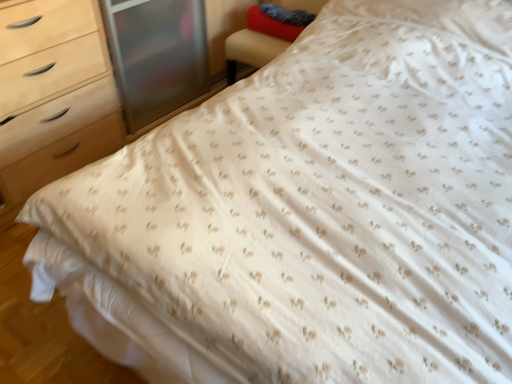
Question: From a real-world perspective, is velvet blue pillow at upper right, positioned as the 2th pillow in back-to-front order, on top of velvet-like red pillow at upper right, arranged as the first pillow when viewed from the back?

Choices:
 (A) yes
 (B) no

Answer: (A)

Question: Considering the relative sizes of velvet blue pillow at upper right, positioned as the 2th pillow in back-to-front order, and velvet-like red pillow at upper right, arranged as the first pillow when viewed from the back, in the image provided, is velvet blue pillow at upper right, positioned as the 2th pillow in back-to-front order, smaller than velvet-like red pillow at upper right, arranged as the first pillow when viewed from the back,?

Choices:
 (A) no
 (B) yes

Answer: (B)

Question: Does velvet blue pillow at upper right, which is the first pillow in front-to-back order, appear on the left side of velvet-like red pillow at upper right, arranged as the first pillow when viewed from the back?

Choices:
 (A) no
 (B) yes

Answer: (B)

Question: Is velvet blue pillow at upper right, positioned as the 2th pillow in back-to-front order, completely or partially outside of velvet-like red pillow at upper right, which appears as the second pillow when viewed from the front?

Choices:
 (A) yes
 (B) no

Answer: (A)

Question: Can you confirm if velvet blue pillow at upper right, positioned as the 2th pillow in back-to-front order, is bigger than velvet-like red pillow at upper right, arranged as the first pillow when viewed from the back?

Choices:
 (A) no
 (B) yes

Answer: (A)

Question: Visually, is velvet-like red pillow at upper right, which appears as the second pillow when viewed from the front, positioned to the left or to the right of velvet blue pillow at upper right, positioned as the 2th pillow in back-to-front order?

Choices:
 (A) right
 (B) left

Answer: (A)

Question: Is velvet-like red pillow at upper right, arranged as the first pillow when viewed from the back, situated inside velvet blue pillow at upper right, which is the first pillow in front-to-back order, or outside?

Choices:
 (A) outside
 (B) inside

Answer: (A)

Question: Is velvet-like red pillow at upper right, arranged as the first pillow when viewed from the back, wider or thinner than velvet blue pillow at upper right, positioned as the 2th pillow in back-to-front order?

Choices:
 (A) wide
 (B) thin

Answer: (A)

Question: Is velvet-like red pillow at upper right, arranged as the first pillow when viewed from the back, in front of or behind velvet blue pillow at upper right, which is the first pillow in front-to-back order, in the image?

Choices:
 (A) front
 (B) behind

Answer: (B)

Question: Considering the positions of red fabric armchair at upper right and velvet-like red pillow at upper right, arranged as the first pillow when viewed from the back, in the image, is red fabric armchair at upper right bigger or smaller than velvet-like red pillow at upper right, arranged as the first pillow when viewed from the back,?

Choices:
 (A) small
 (B) big

Answer: (B)

Question: Choose the correct answer: Is red fabric armchair at upper right inside velvet-like red pillow at upper right, arranged as the first pillow when viewed from the back, or outside it?

Choices:
 (A) inside
 (B) outside

Answer: (B)

Question: Considering the relative positions of red fabric armchair at upper right and velvet-like red pillow at upper right, arranged as the first pillow when viewed from the back, in the image provided, is red fabric armchair at upper right to the left or to the right of velvet-like red pillow at upper right, arranged as the first pillow when viewed from the back,?

Choices:
 (A) right
 (B) left

Answer: (A)

Question: Considering the positions of point (310, 9) and point (253, 13), is point (310, 9) closer or farther from the camera than point (253, 13)?

Choices:
 (A) farther
 (B) closer

Answer: (B)

Question: Which is correct: velvet blue pillow at upper right, which is the first pillow in front-to-back order, is inside velvet-like red pillow at upper right, which appears as the second pillow when viewed from the front, or outside of it?

Choices:
 (A) inside
 (B) outside

Answer: (B)

Question: Does point (272, 3) appear closer or farther from the camera than point (311, 16)?

Choices:
 (A) farther
 (B) closer

Answer: (A)